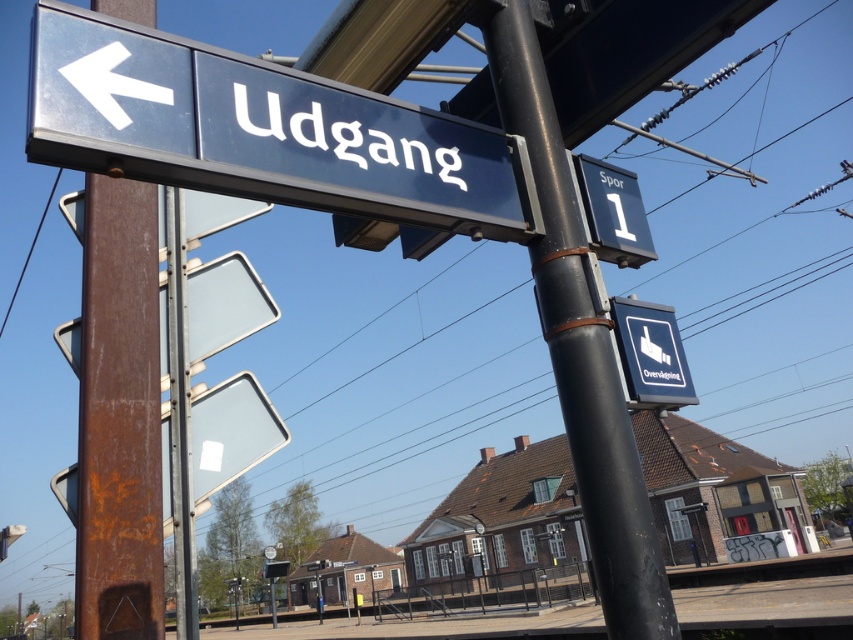
Does blue metallic sign at upper left have a smaller size compared to blue plastic sign at lower right?

No.

Consider the image. Is blue metallic sign at upper left to the right of blue plastic sign at lower right from the viewer's perspective?

Incorrect, blue metallic sign at upper left is not on the right side of blue plastic sign at lower right.

Which is behind, point (372, 172) or point (674, 394)?

Point (674, 394)

You are a GUI agent. You are given a task and a screenshot of the screen. Output one action in this format:
    pyautogui.click(x=<x>, y=<y>)
    Task: Click on the blue metallic sign at upper left
    
    Given the screenshot: What is the action you would take?
    pyautogui.click(x=262, y=131)

Is black metal pole at center thinner than blue plastic sign at lower right?

Incorrect, black metal pole at center's width is not less than blue plastic sign at lower right's.

What do you see at coordinates (579, 342) in the screenshot?
I see `black metal pole at center` at bounding box center [579, 342].

The image size is (853, 640). In order to click on black metal pole at center in this screenshot , I will do `click(579, 342)`.

This screenshot has width=853, height=640. What do you see at coordinates (262, 131) in the screenshot?
I see `blue metallic sign at upper left` at bounding box center [262, 131].

Is blue metallic sign at upper left bigger than black metal pole at center?

Incorrect, blue metallic sign at upper left is not larger than black metal pole at center.

Does point (343, 198) come behind point (666, 604)?

That is False.

Where is `blue metallic sign at upper left`? blue metallic sign at upper left is located at coordinates (262, 131).